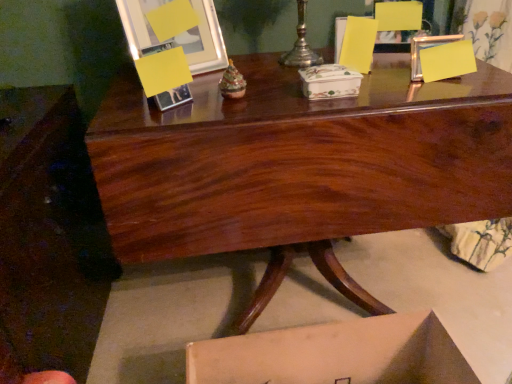
Identify the location of vacant area that lies to the right of metallic silver picture frame at upper left. This screenshot has width=512, height=384. (245, 71).